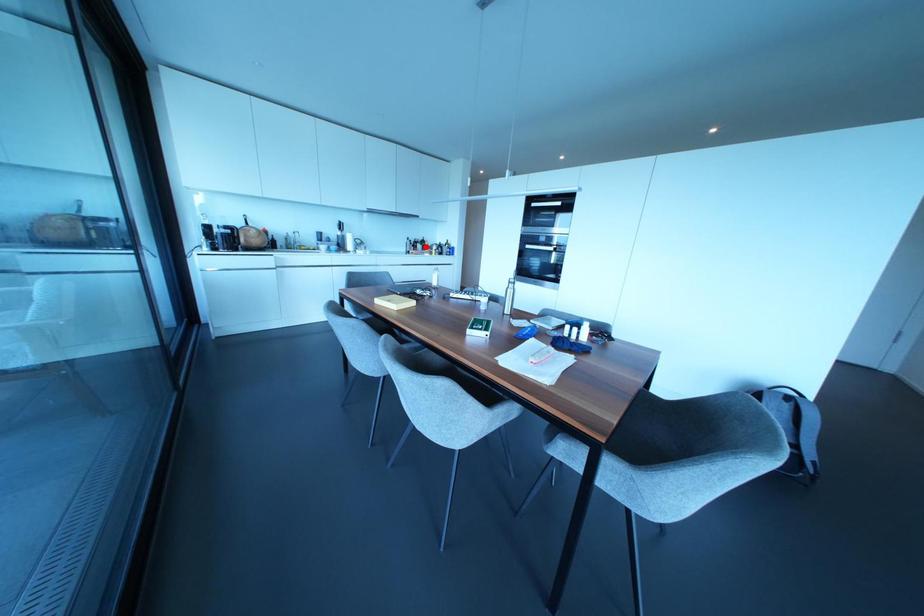
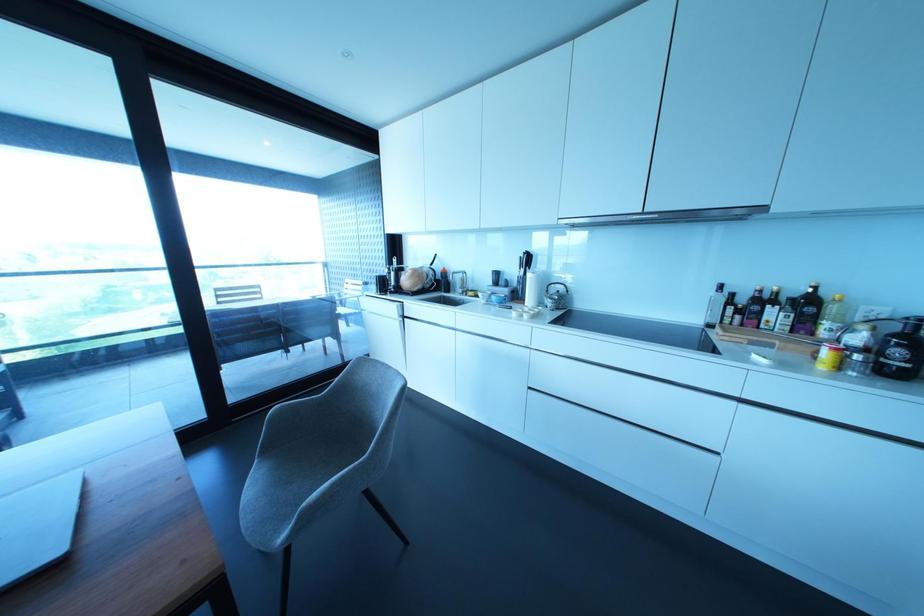
Question: I am providing you with two images of the same scene from different viewpoints. In image1, a red point is highlighted. Considering the same 3D point in image2, which of the following is correct?

Choices:
 (A) It is closer
 (B) It is farther

Answer: (B)